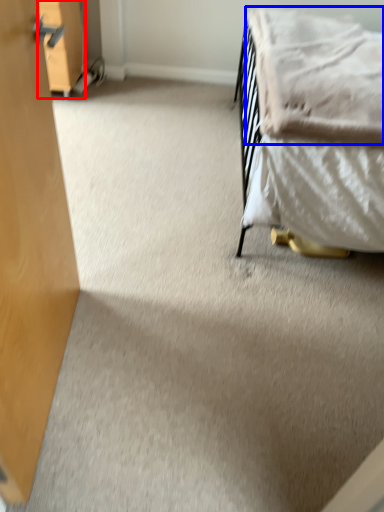
Question: Which of the following is the farthest to the observer, drawer (highlighted by a red box) or blanket (highlighted by a blue box)?

Choices:
 (A) drawer
 (B) blanket

Answer: (A)